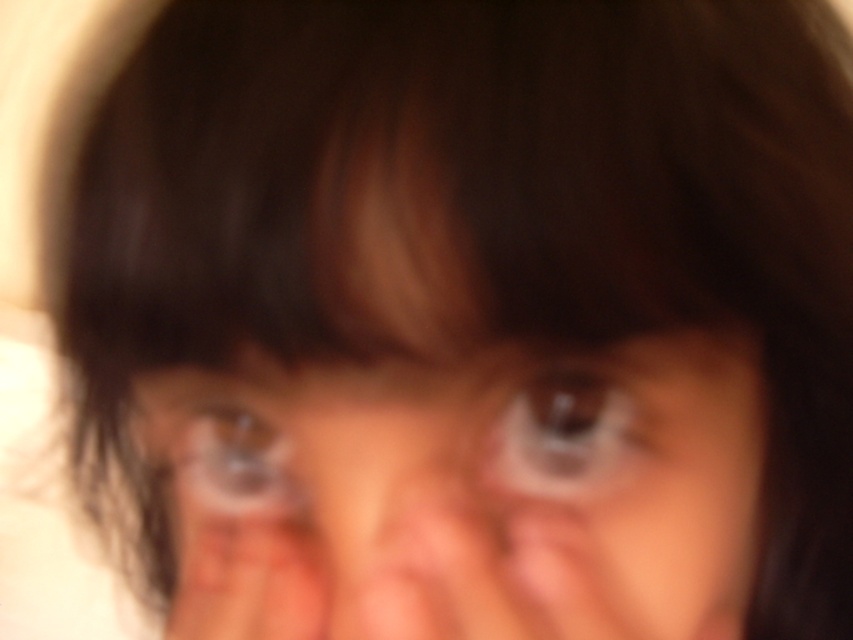
You are a photographer trying to adjust the focus on a blurry image of a person. You notice two translucent plastic eyes at center and translucent plastic eye at center in the photo. Which one is positioned lower on the face?

The translucent plastic eyes at center is located below the translucent plastic eye at center, so it is positioned lower on the face.

You are a photographer reviewing a blurry portrait of a person. You notice two eyes in the image, the brown glossy eye at center and the translucent plastic eye at center. Which eye takes up more space in the photo?

The translucent plastic eye at center takes up more space in the photo because the brown glossy eye at center occupies less space than it.

You are a photographer reviewing a blurry portrait. You notice two objects in the image labeled as translucent plastic eyes at center and translucent plastic eye at center. Which of these two objects is wider according to the description?

The translucent plastic eyes at center might be wider than translucent plastic eye at center.